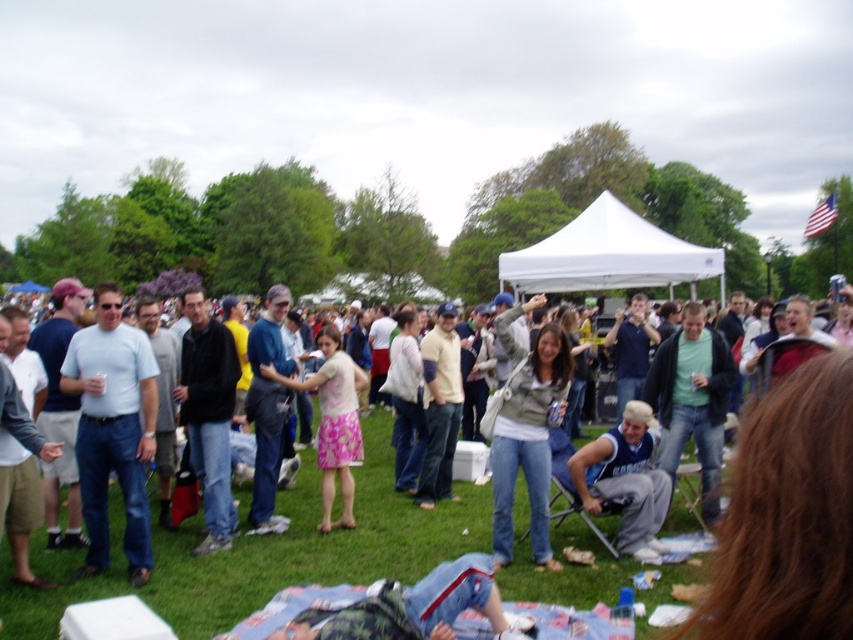
You are at the center of the gathering and want to move towards the white fabric canopy at center. Which direction should you move relative to the light brown denim jeans at center?

The white fabric canopy at center is to the right of the light brown denim jeans at center, so you should move to the right of the light brown denim jeans at center to reach the white fabric canopy at center.

You are standing at the center of the field and see two points marked in the image. The first point is at coordinates point (142, 458) and the second is at point (440, 404). Which point is closer to you?

Point (142, 458) is in front of point (440, 404), so the first point is closer to you.

You are at the center of the grassy field and want to find the white fabric canopy at center. In which direction should you walk to reach it?

Since the white fabric canopy at center is located at point (x=608, y=256), you should walk north to reach it.